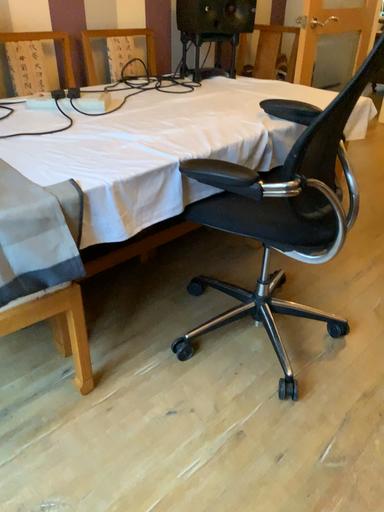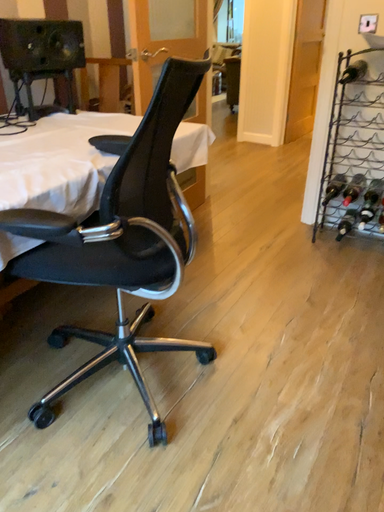
Question: Which way did the camera rotate in the video?

Choices:
 (A) rotated left
 (B) rotated right

Answer: (B)